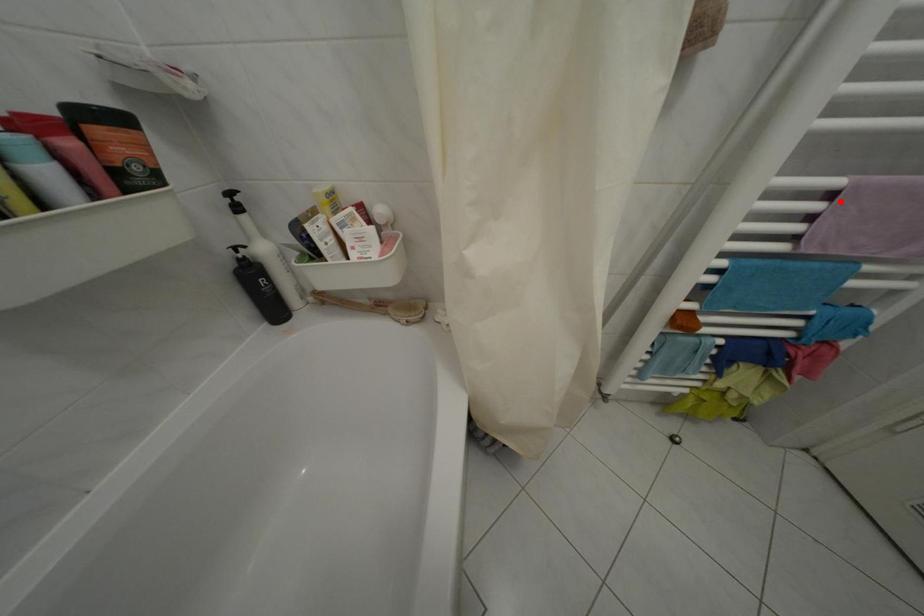
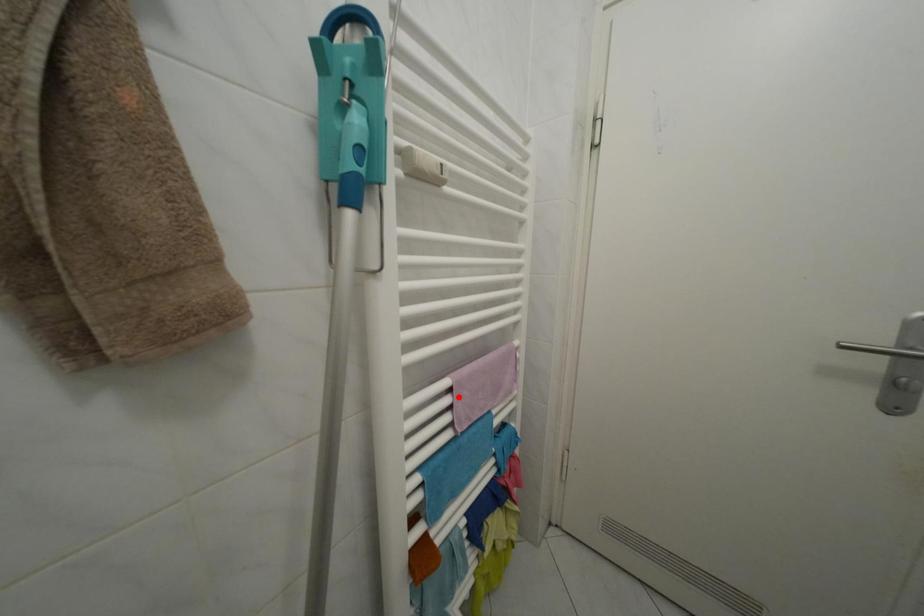
I am providing you with two images of the same scene from different viewpoints. A red point is marked on the first image and another point is marked on the second image. Does the point marked in image1 correspond to the same location as the one in image2?

Yes